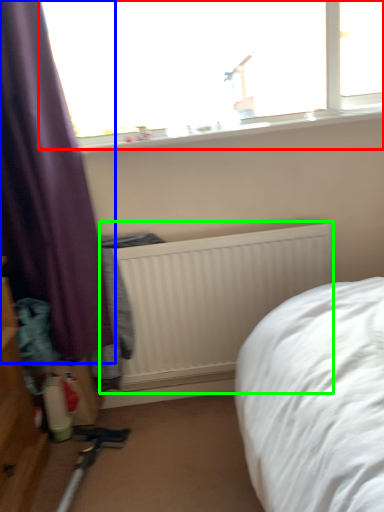
Question: Which object is positioned closest to window (highlighted by a red box)? Select from curtain (highlighted by a blue box) and radiator (highlighted by a green box).

Choices:
 (A) curtain
 (B) radiator

Answer: (A)